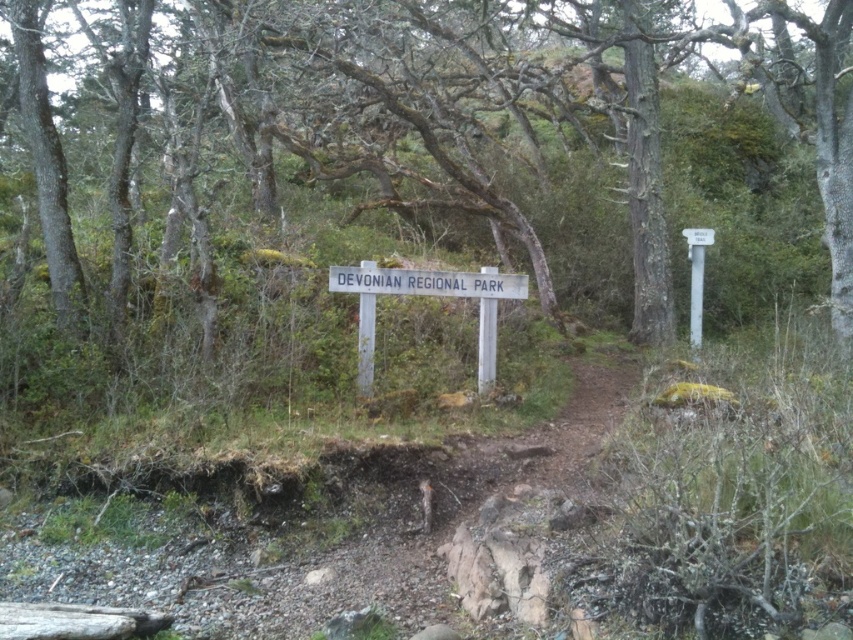
Question: Is green mossy tree at center thinner than white plastic signpost at upper right?

Choices:
 (A) yes
 (B) no

Answer: (B)

Question: Is white wooden sign at center below white plastic signpost at upper right?

Choices:
 (A) yes
 (B) no

Answer: (A)

Question: Which object appears closest to the camera in this image?

Choices:
 (A) white wooden sign at center
 (B) white plastic signpost at upper right

Answer: (A)

Question: Which of the following is the farthest from the observer?

Choices:
 (A) white wooden sign at center
 (B) white plastic signpost at upper right

Answer: (B)

Question: Among these points, which one is farthest from the camera?

Choices:
 (A) (94, 204)
 (B) (691, 291)

Answer: (B)

Question: Is green mossy tree at center bigger than white wooden sign at center?

Choices:
 (A) no
 (B) yes

Answer: (A)